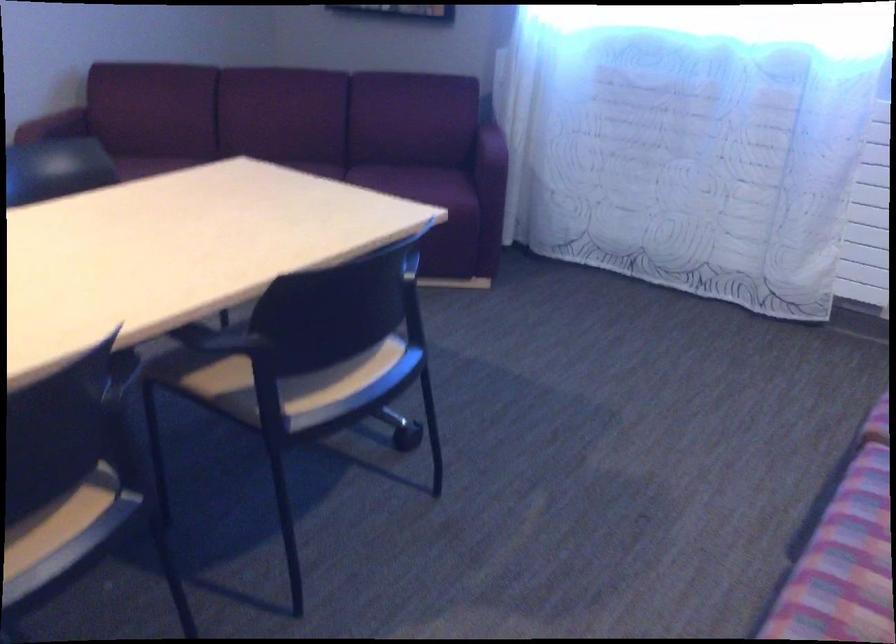
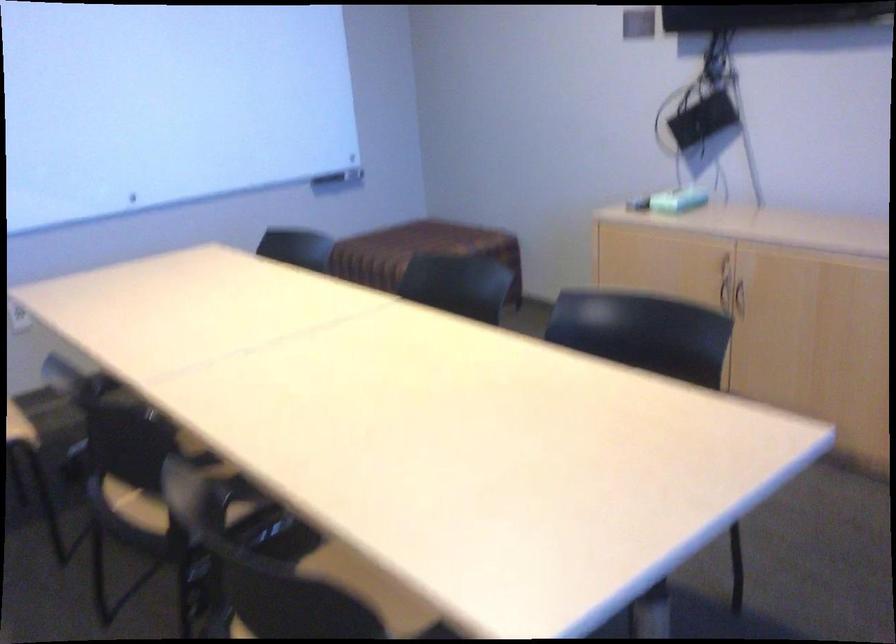
Locate, in the second image, the point that corresponds to point 200,393 in the first image.

(337, 569)